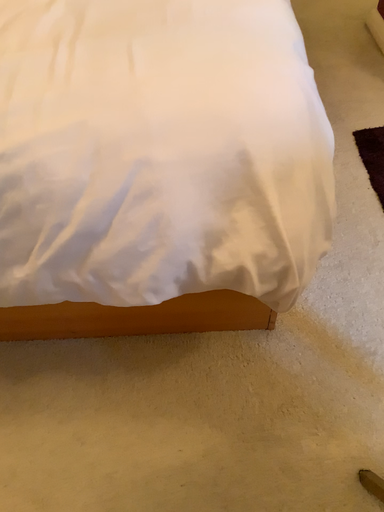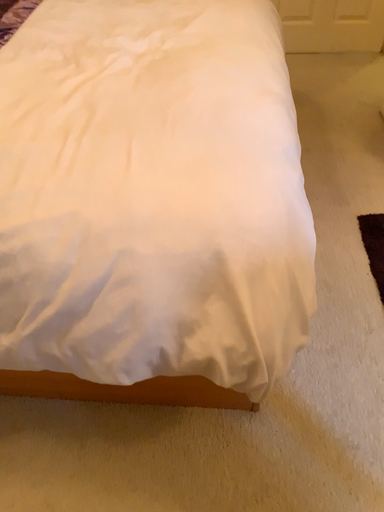
Question: Which way did the camera rotate in the video?

Choices:
 (A) rotated downward
 (B) rotated upward

Answer: (B)